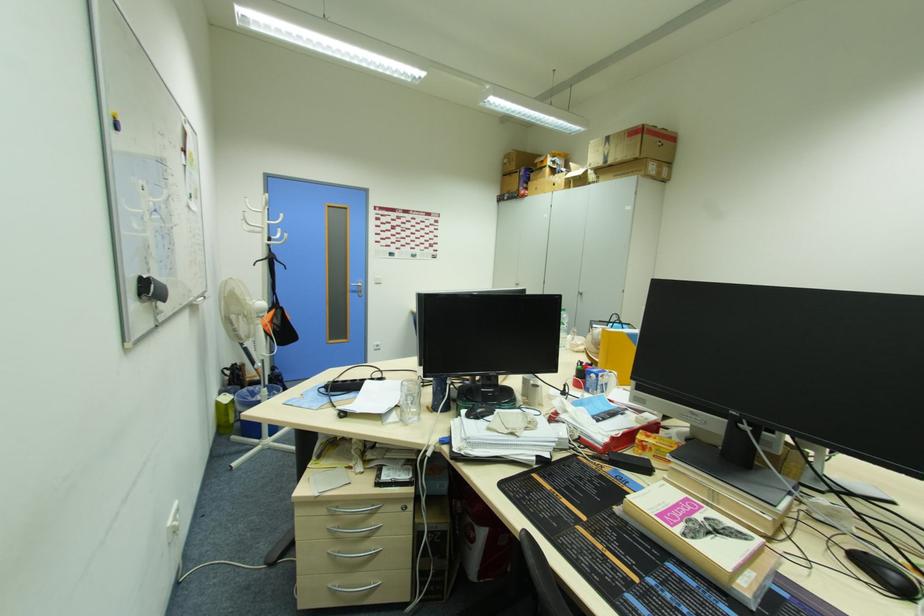
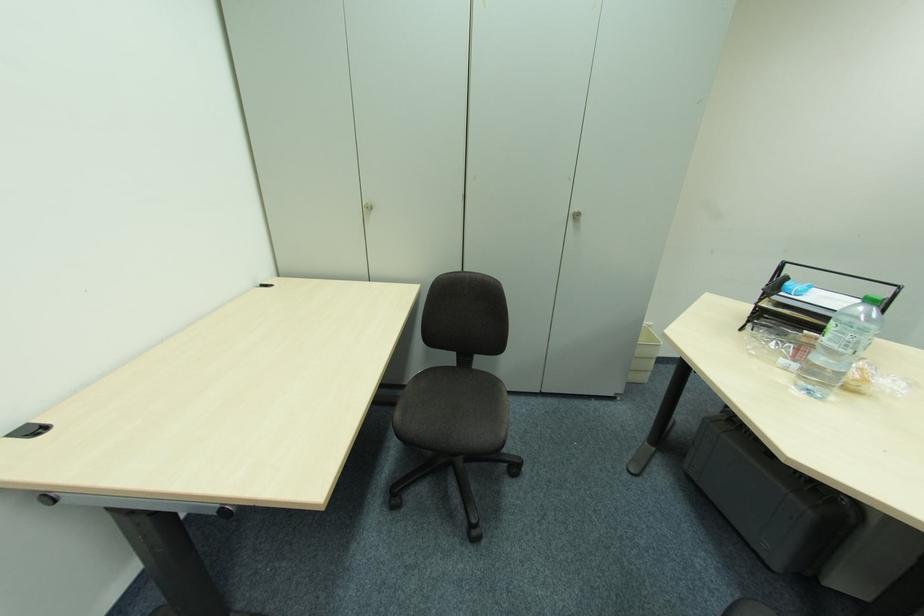
Find the pixel in the second image that matches the point at 582,296 in the first image.

(574, 219)